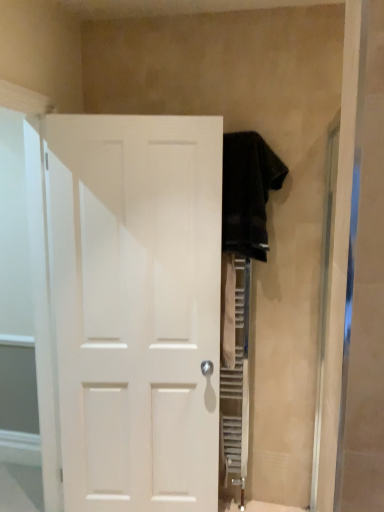
Question: Could you tell me if dark brown towel at upper right is facing white matte door at center?

Choices:
 (A) no
 (B) yes

Answer: (A)

Question: Is dark brown towel at upper right further to camera compared to white matte door at center?

Choices:
 (A) yes
 (B) no

Answer: (A)

Question: Can you confirm if dark brown towel at upper right is thinner than white matte door at center?

Choices:
 (A) no
 (B) yes

Answer: (A)

Question: Is dark brown towel at upper right surrounding white matte door at center?

Choices:
 (A) yes
 (B) no

Answer: (B)

Question: Is dark brown towel at upper right wider than white matte door at center?

Choices:
 (A) no
 (B) yes

Answer: (B)

Question: Considering the positions of white matte door at center and transparent glass door at left in the image, is white matte door at center wider or thinner than transparent glass door at left?

Choices:
 (A) thin
 (B) wide

Answer: (A)

Question: Considering the positions of white matte door at center and transparent glass door at left in the image, is white matte door at center taller or shorter than transparent glass door at left?

Choices:
 (A) short
 (B) tall

Answer: (A)

Question: Does point (62, 139) appear closer or farther from the camera than point (18, 394)?

Choices:
 (A) farther
 (B) closer

Answer: (B)

Question: From a real-world perspective, relative to transparent glass door at left, is white matte door at center vertically above or below?

Choices:
 (A) above
 (B) below

Answer: (B)

Question: From the image's perspective, is dark brown towel at upper right located above or below white matte door at center?

Choices:
 (A) above
 (B) below

Answer: (A)

Question: In terms of width, does dark brown towel at upper right look wider or thinner when compared to white matte door at center?

Choices:
 (A) wide
 (B) thin

Answer: (A)

Question: From their relative heights in the image, would you say dark brown towel at upper right is taller or shorter than white matte door at center?

Choices:
 (A) tall
 (B) short

Answer: (B)

Question: Relative to white matte door at center, is dark brown towel at upper right in front or behind?

Choices:
 (A) front
 (B) behind

Answer: (B)

Question: Considering the positions of point [x=246, y=239] and point [x=16, y=143], is point [x=246, y=239] closer or farther from the camera than point [x=16, y=143]?

Choices:
 (A) closer
 (B) farther

Answer: (A)

Question: Is dark brown towel at upper right wider or thinner than transparent glass door at left?

Choices:
 (A) thin
 (B) wide

Answer: (B)